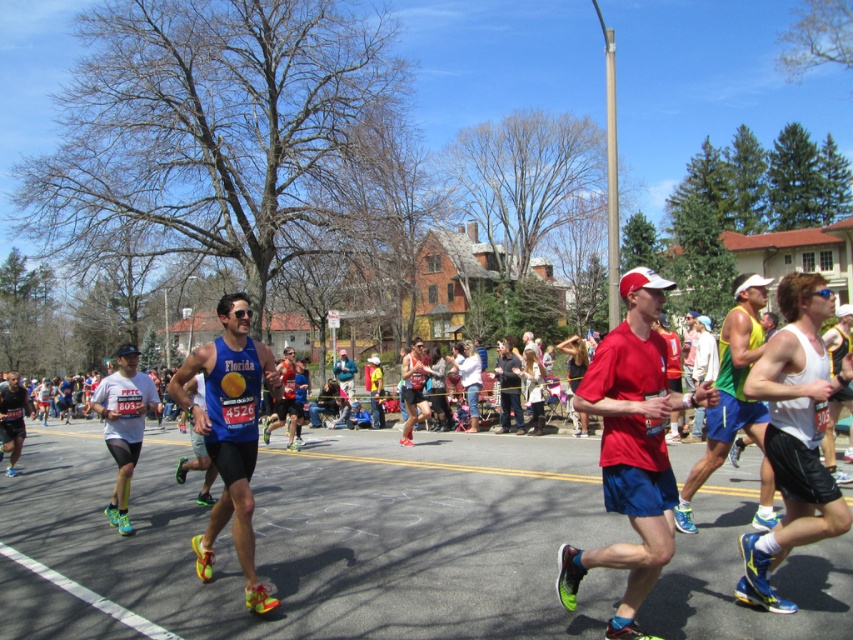
Is white matte tank top at center bigger than matte black shorts at left?

No.

Which of these two, white matte tank top at center or matte black shorts at left, stands shorter?

white matte tank top at center is shorter.

Which is behind, point (833, 378) or point (32, 404)?

Positioned behind is point (32, 404).

At what (x,y) coordinates should I click in order to perform the action: click on white matte tank top at center. Please return your answer as a coordinate pair (x, y). The width and height of the screenshot is (853, 640). Looking at the image, I should click on (793, 436).

Between blue fabric tank top at center and white matte cap at upper center, which one is positioned lower?

blue fabric tank top at center is below.

Does blue fabric tank top at center have a larger size compared to white matte cap at upper center?

Correct, blue fabric tank top at center is larger in size than white matte cap at upper center.

Is point (186, 401) farther from camera compared to point (706, 374)?

No, (186, 401) is in front of (706, 374).

Identify the location of blue fabric tank top at center. (230, 433).

Is matte red shirt at center to the right of matte black shorts at left from the viewer's perspective?

Yes, matte red shirt at center is to the right of matte black shorts at left.

Between matte red shirt at center and matte black shorts at left, which one has more height?

matte black shorts at left is taller.

The image size is (853, 640). What do you see at coordinates (631, 449) in the screenshot?
I see `matte red shirt at center` at bounding box center [631, 449].

Find the location of a particular element. The image size is (853, 640). matte red shirt at center is located at coordinates pos(631,449).